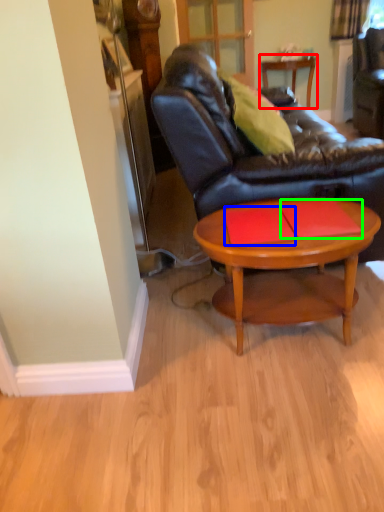
Question: Which object is the farthest from table (highlighted by a red box)? Choose among these: plank (highlighted by a blue box) or plank (highlighted by a green box).

Choices:
 (A) plank
 (B) plank

Answer: (A)